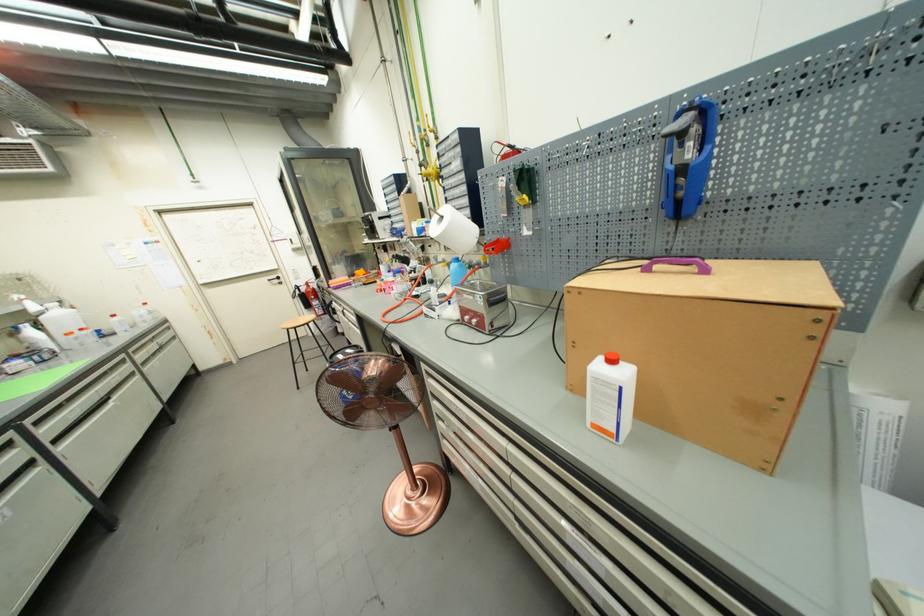
Describe the element at coordinates (687, 156) in the screenshot. This screenshot has height=616, width=924. I see `a blue tool handle` at that location.